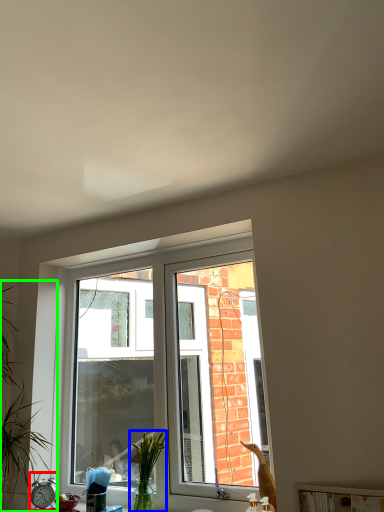
Question: Estimate the real-world distances between objects in this image. Which object is farther from alarm clock (highlighted by a red box), plant (highlighted by a blue box) or houseplant (highlighted by a green box)?

Choices:
 (A) plant
 (B) houseplant

Answer: (A)